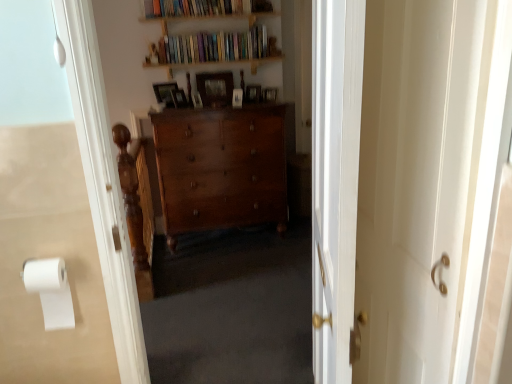
Question: Considering the relative positions of wooden picture frame at center, the 3th picture frame in the left-to-right sequence, and white matte toilet paper at left in the image provided, is wooden picture frame at center, the 3th picture frame in the left-to-right sequence, to the left or to the right of white matte toilet paper at left?

Choices:
 (A) left
 (B) right

Answer: (B)

Question: Is point (220, 107) closer or farther from the camera than point (44, 268)?

Choices:
 (A) closer
 (B) farther

Answer: (B)

Question: Estimate the real-world distances between objects in this image. Which object is farther from the wooden bookshelf at upper center, which appears as the 2th book when ordered from the bottom?

Choices:
 (A) wooden picture frame at center, the 1th picture frame in the left-to-right sequence
 (B) wooden picture frame at center, which is the sixth picture frame in left-to-right order
 (C) wooden picture frame at center, the 3th picture frame in the left-to-right sequence
 (D) white glossy screen door at center
 (E) polished wood dresser at center

Answer: (D)

Question: Which object is the farthest from the wooden picture frame at center, which is the 3th picture frame in right-to-left order?

Choices:
 (A) wooden picture frame at center, the first picture frame viewed from the right
 (B) wooden picture frame at center, the sixth picture frame in the right-to-left sequence
 (C) white matte toilet paper at left
 (D) white glossy screen door at center
 (E) wooden picture frame at center, arranged as the 4th picture frame when viewed from the right

Answer: (D)